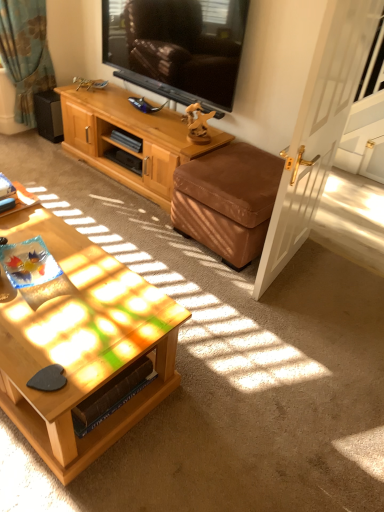
What is the approximate height of brown leather ottoman at lower right?

brown leather ottoman at lower right is 18.38 inches tall.

The width and height of the screenshot is (384, 512). Describe the element at coordinates (48, 115) in the screenshot. I see `black matte speaker at left` at that location.

Where is `black glossy television at upper center`? This screenshot has height=512, width=384. black glossy television at upper center is located at coordinates (177, 47).

You are a GUI agent. You are given a task and a screenshot of the screen. Output one action in this format:
    pyautogui.click(x=<x>, y=<y>)
    Task: Click on the woodenobject at lower left
    The width and height of the screenshot is (384, 512).
    Given the screenshot: What is the action you would take?
    pyautogui.click(x=81, y=343)

The height and width of the screenshot is (512, 384). I want to click on teal fabric curtain at upper left, so click(25, 54).

Considering the positions of points (10, 341) and (36, 202), is point (10, 341) closer to camera compared to point (36, 202)?

Yes, point (10, 341) is closer to viewer.

Are woodenobject at lower left and wooden desk at lower left located far from each other?

No.

Is woodenobject at lower left not inside wooden desk at lower left?

Yes, woodenobject at lower left is located beyond the bounds of wooden desk at lower left.

Is woodenobject at lower left oriented away from wooden desk at lower left?

No, woodenobject at lower left is not facing away from wooden desk at lower left.

Where is `coffee table that is in front of the wooden desk at lower left`? This screenshot has width=384, height=512. coffee table that is in front of the wooden desk at lower left is located at coordinates (81, 343).

Is wooden desk at lower left not near woodenobject at lower left?

No, wooden desk at lower left is not far from woodenobject at lower left.

Looking at this image, from the image's perspective, is wooden desk at lower left on top of woodenobject at lower left?

Yes.

Does wooden desk at lower left lie in front of woodenobject at lower left?

No, the depth of wooden desk at lower left is greater than that of woodenobject at lower left.

From a real-world perspective, is black matte speaker at left positioned over light brown wood cabinet at upper center based on gravity?

No, from a real-world perspective, black matte speaker at left is not above light brown wood cabinet at upper center.

Find the location of a particular element. Image resolution: width=384 pixels, height=512 pixels. loudspeaker located underneath the light brown wood cabinet at upper center (from a real-world perspective) is located at coordinates (x=48, y=115).

Considering the relative sizes of black matte speaker at left and light brown wood cabinet at upper center in the image provided, is black matte speaker at left wider than light brown wood cabinet at upper center?

Incorrect, the width of black matte speaker at left does not surpass that of light brown wood cabinet at upper center.

Is black matte speaker at left bigger or smaller than light brown wood cabinet at upper center?

Considering their sizes, black matte speaker at left takes up less space than light brown wood cabinet at upper center.

From a real-world perspective, is light brown wood cabinet at upper center physically located above or below teal fabric curtain at upper left?

From a real-world perspective, light brown wood cabinet at upper center is physically below teal fabric curtain at upper left.

Looking at the image, does light brown wood cabinet at upper center seem bigger or smaller compared to teal fabric curtain at upper left?

Clearly, light brown wood cabinet at upper center is larger in size than teal fabric curtain at upper left.

Is point (175, 121) less distant than point (44, 66)?

Yes, point (175, 121) is in front of point (44, 66).

Is light brown wood cabinet at upper center to the right of teal fabric curtain at upper left from the viewer's perspective?

Yes, light brown wood cabinet at upper center is to the right of teal fabric curtain at upper left.

From the image's perspective, is woodenobject at lower left over teal fabric curtain at upper left?

Actually, woodenobject at lower left appears below teal fabric curtain at upper left in the image.

Identify the location of curtain on the left of woodenobject at lower left. The width and height of the screenshot is (384, 512). (25, 54).

Is woodenobject at lower left far away from teal fabric curtain at upper left?

That's right, there is a large distance between woodenobject at lower left and teal fabric curtain at upper left.

Considering the relative positions of woodenobject at lower left and teal fabric curtain at upper left in the image provided, is woodenobject at lower left to the left or to the right of teal fabric curtain at upper left?

Based on their positions, woodenobject at lower left is located to the right of teal fabric curtain at upper left.

Considering the sizes of wooden desk at lower left and white glossy door at right in the image, is wooden desk at lower left wider or thinner than white glossy door at right?

Clearly, wooden desk at lower left has more width compared to white glossy door at right.

Does wooden desk at lower left lie behind white glossy door at right?

That is True.

Are wooden desk at lower left and white glossy door at right far apart?

Indeed, wooden desk at lower left is not near white glossy door at right.

Is wooden desk at lower left completely or partially outside of white glossy door at right?

That's correct, wooden desk at lower left is outside of white glossy door at right.

In terms of width, does light brown wood cabinet at upper center look wider or thinner when compared to black matte speaker at left?

In the image, light brown wood cabinet at upper center appears to be wider than black matte speaker at left.

This screenshot has width=384, height=512. What are the coordinates of `cabinetry located on the right of black matte speaker at left` in the screenshot? It's located at (130, 135).

From a real-world perspective, which object rests below the other?

black matte speaker at left, from a real-world perspective.

Which is closer to the camera, (x=125, y=113) or (x=47, y=94)?

Clearly, point (x=125, y=113) is closer to the camera than point (x=47, y=94).

Locate an element on the screen. The height and width of the screenshot is (512, 384). desk positioned vertically above the woodenobject at lower left (from a real-world perspective) is located at coordinates (21, 200).

Identify the location of desk lying above the woodenobject at lower left (from the image's perspective). (21, 200).

Considering their positions, is wooden desk at lower left positioned closer to woodenobject at lower left than black glossy television at upper center?

Based on the image, wooden desk at lower left appears to be nearer to woodenobject at lower left.

Looking at the image, which one is located further to light brown wood cabinet at upper center, black matte speaker at left or wooden desk at lower left?

Among the two, wooden desk at lower left is located further to light brown wood cabinet at upper center.

Based on their spatial positions, is light brown wood cabinet at upper center or black glossy television at upper center further from brown leather ottoman at lower right?

Based on the image, black glossy television at upper center appears to be further to brown leather ottoman at lower right.

In the scene shown: Estimate the real-world distances between objects in this image. Which object is further from teal fabric curtain at upper left, black glossy television at upper center or woodenobject at lower left?

The object further to teal fabric curtain at upper left is woodenobject at lower left.

Which object lies further to the anchor point woodenobject at lower left, brown leather ottoman at lower right or black matte speaker at left?

black matte speaker at left.

Based on their spatial positions, is light brown wood cabinet at upper center or black glossy television at upper center further from black matte speaker at left?

The object further to black matte speaker at left is black glossy television at upper center.

From the image, which object appears to be nearer to brown leather ottoman at lower right, black matte speaker at left or wooden desk at lower left?

The object closer to brown leather ottoman at lower right is wooden desk at lower left.

Based on their spatial positions, is light brown wood cabinet at upper center or black glossy television at upper center closer to white glossy door at right?

The object closer to white glossy door at right is black glossy television at upper center.

At what (x,y) coordinates should I click in order to perform the action: click on ottoman positioned between wooden desk at lower left and black matte speaker at left from near to far. Please return your answer as a coordinate pair (x, y). This screenshot has height=512, width=384. Looking at the image, I should click on (227, 200).

Locate an element on the screen. The image size is (384, 512). desk located between woodenobject at lower left and light brown wood cabinet at upper center in the depth direction is located at coordinates (21, 200).

The height and width of the screenshot is (512, 384). What are the coordinates of `coffee table between teal fabric curtain at upper left and white glossy door at right from left to right` in the screenshot? It's located at (81, 343).

In order to click on television located between white glossy door at right and light brown wood cabinet at upper center in the depth direction in this screenshot , I will do `click(177, 47)`.